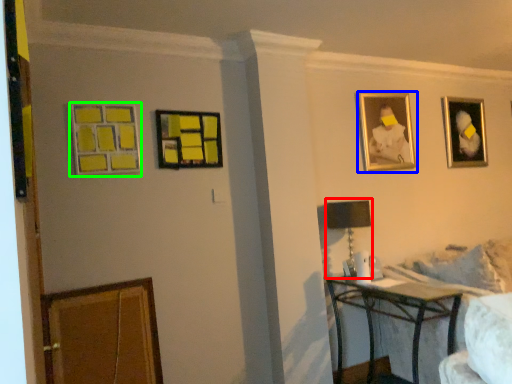
Question: Which object is the farthest from table lamp (highlighted by a red box)? Choose among these: picture frame (highlighted by a blue box) or picture frame (highlighted by a green box).

Choices:
 (A) picture frame
 (B) picture frame

Answer: (B)